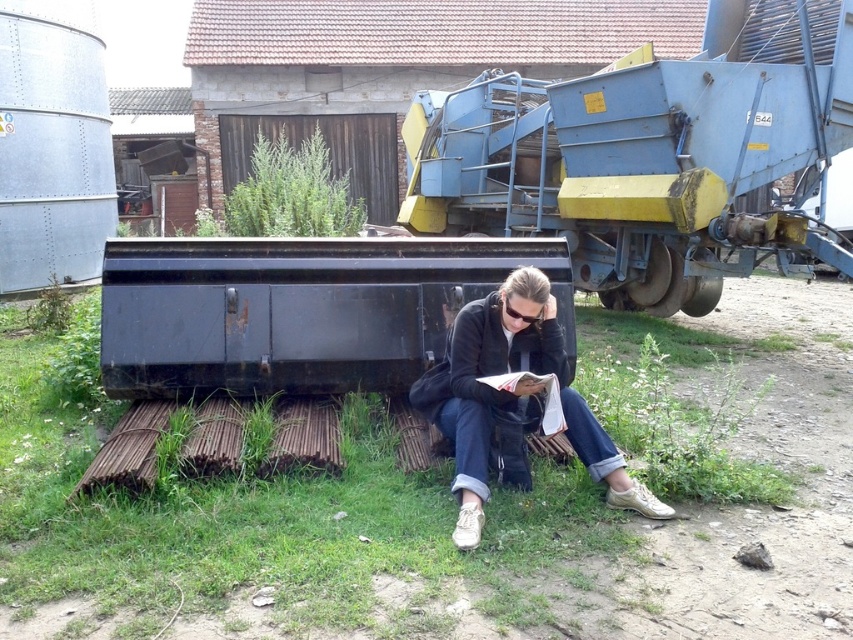
Is green grass at lower center above denim jeans at lower center?

No.

Which of these two, green grass at lower center or denim jeans at lower center, stands taller?

Standing taller between the two is denim jeans at lower center.

The image size is (853, 640). Identify the location of green grass at lower center. (450, 525).

Image resolution: width=853 pixels, height=640 pixels. Identify the location of green grass at lower center. (450, 525).